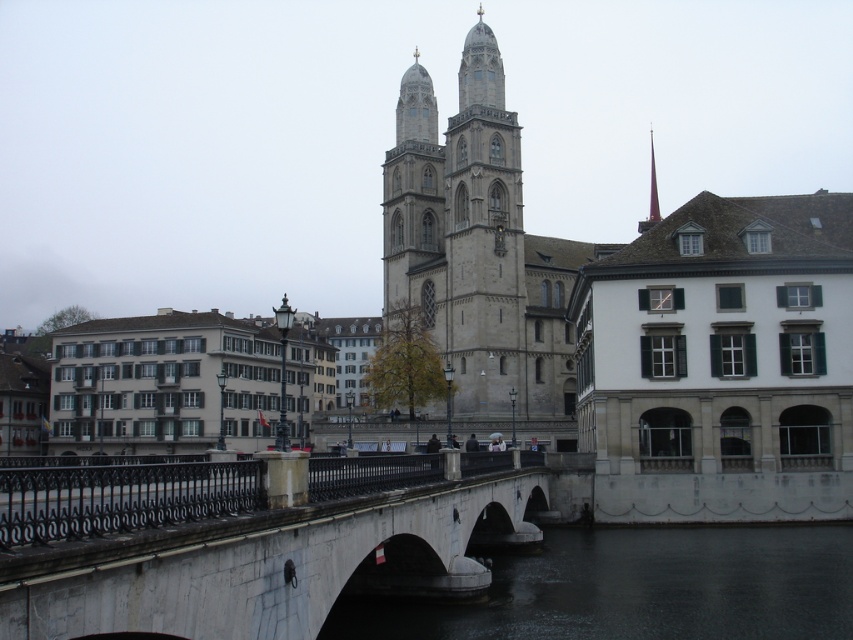
Consider the image. Between smooth stone bridge at center and gray stone tower at center, which one appears on the right side from the viewer's perspective?

Positioned to the right is gray stone tower at center.

Does point (177, 573) come in front of point (480, 241)?

Yes, it is in front of point (480, 241).

This screenshot has height=640, width=853. What are the coordinates of `smooth stone bridge at center` in the screenshot? It's located at (271, 563).

This screenshot has height=640, width=853. What are the coordinates of `smooth stone bridge at center` in the screenshot? It's located at (271, 563).

Does smooth stone bridge at center have a greater height compared to smooth gray spire at upper center?

No.

This screenshot has height=640, width=853. Describe the element at coordinates (271, 563) in the screenshot. I see `smooth stone bridge at center` at that location.

Between point (10, 564) and point (650, 164), which one is positioned behind?

Point (650, 164)

Locate an element on the screen. The width and height of the screenshot is (853, 640). smooth stone bridge at center is located at coordinates (271, 563).

Who is higher up, gray stone tower at center or smooth gray spire at upper center?

Positioned higher is smooth gray spire at upper center.

Is point (498, 54) closer to camera compared to point (657, 220)?

Yes, point (498, 54) is in front of point (657, 220).

At what (x,y) coordinates should I click in order to perform the action: click on gray stone tower at center. Please return your answer as a coordinate pair (x, y). Looking at the image, I should click on (483, 236).